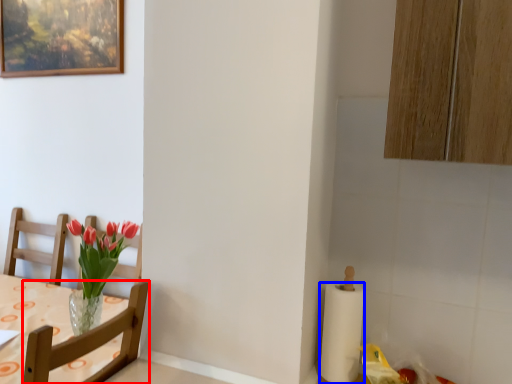
Question: Which object is further to the camera taking this photo, chair (highlighted by a red box) or paper towel (highlighted by a blue box)?

Choices:
 (A) chair
 (B) paper towel

Answer: (B)